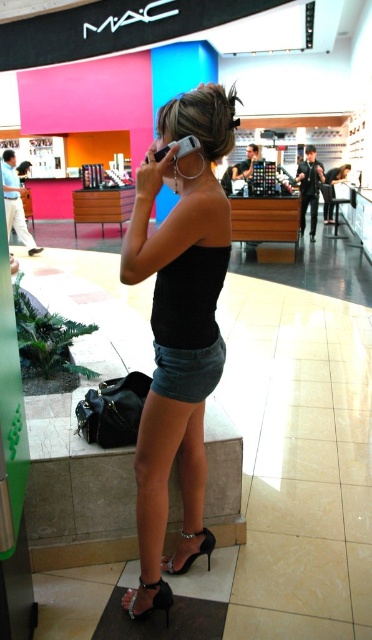
You are a customer in the store and you want to see both the matte black phone at upper left and the white plastic phone at upper center. Which phone should you move closer to first to see both without moving your head?

You should move closer to the matte black phone at upper left first because the white plastic phone at upper center is behind it, so by moving towards the front phone, you can see both without needing to adjust your head position.

You are standing at point (187, 147) and want to walk to point (158, 582). Is the destination point behind you or in front of you?

The destination point (158, 582) is behind point (187, 147), so it is behind you.